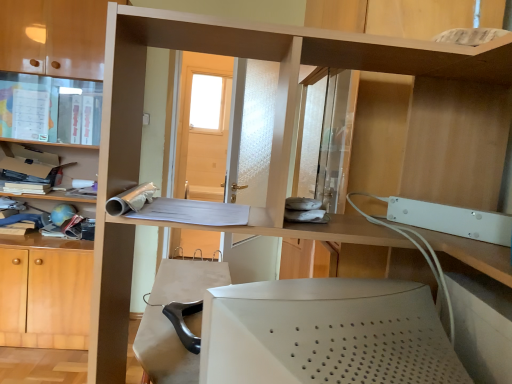
Question: Does point (77, 147) appear closer or farther from the camera than point (329, 337)?

Choices:
 (A) closer
 (B) farther

Answer: (B)

Question: From the image's perspective, is matte plastic shelf at left, which is the first shelf in left-to-right order, located above or below white matte desktop computer at lower center?

Choices:
 (A) below
 (B) above

Answer: (B)

Question: Estimate the real-world distances between objects in this image. Which object is farther from the matte brown bookcase at left?

Choices:
 (A) matte plastic shelf at left, the 1th shelf positioned from the back
 (B) wooden shelf at upper right, placed as the second shelf when sorted from back to front
 (C) matte plastic cabinet at upper left
 (D) white matte desktop computer at lower center

Answer: (D)

Question: Estimate the real-world distances between objects in this image. Which object is farther from the matte plastic cabinet at upper left?

Choices:
 (A) matte brown bookcase at left
 (B) matte plastic shelf at left, which is counted as the 2th shelf, starting from the right
 (C) wooden shelf at upper right, the second shelf positioned from the left
 (D) white matte desktop computer at lower center

Answer: (D)